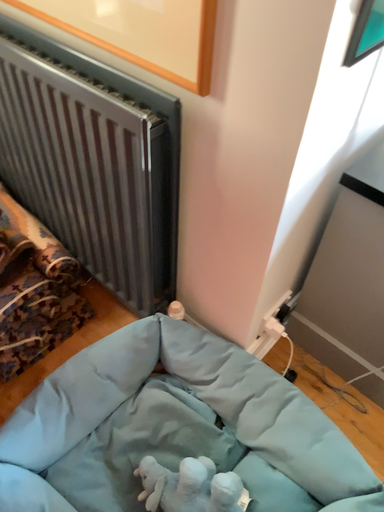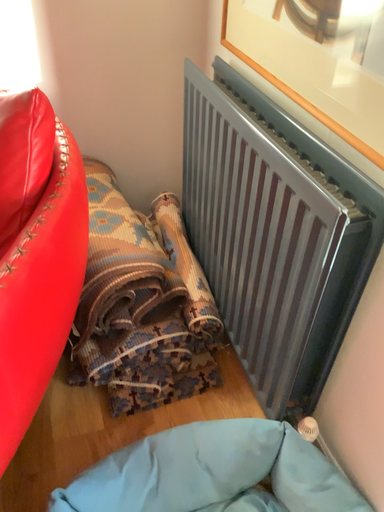
Question: How did the camera likely rotate when shooting the video?

Choices:
 (A) rotated downward
 (B) rotated upward

Answer: (B)